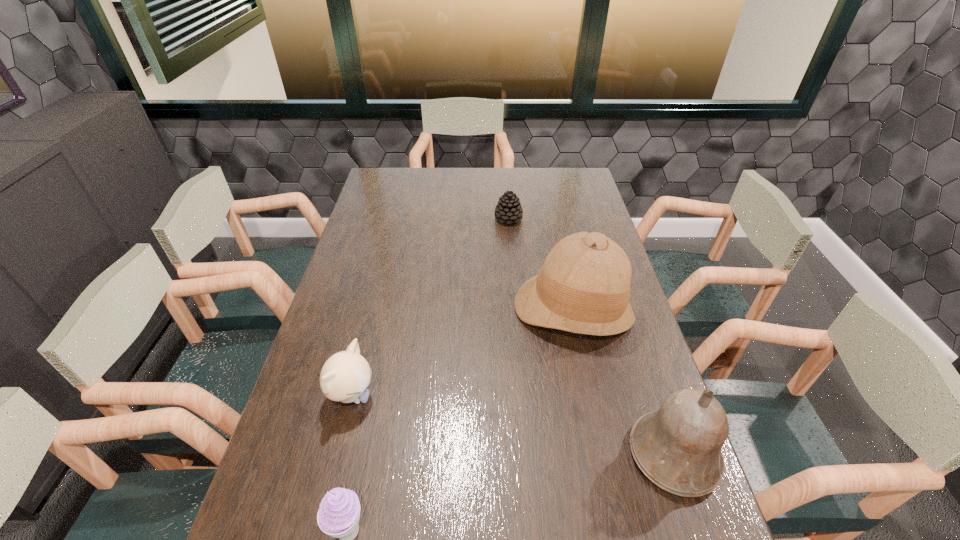
Where is `free spot between the bell and the tallest object`? The image size is (960, 540). free spot between the bell and the tallest object is located at coordinates (623, 382).

Locate an element on the screen. The height and width of the screenshot is (540, 960). free space between the hat and the kitten is located at coordinates (463, 353).

The image size is (960, 540). I want to click on vacant region between the kitten and the fourth shortest object, so click(513, 424).

Locate an element on the screen. The width and height of the screenshot is (960, 540). object that is the third nearest to the nearest object is located at coordinates (678, 448).

Locate which object ranks in proximity to the bell. Please provide its 2D coordinates. Your answer should be formatted as a tuple, i.e. [(x, y)], where the tuple contains the x and y coordinates of a point satisfying the conditions above.

[(583, 287)]

Identify the location of free space that satisfies the following two spatial constraints: 1. on the back side of the farthest object; 2. on the right side of the kitten. (396, 219).

This screenshot has width=960, height=540. What are the coordinates of `vacant space that satisfies the following two spatial constraints: 1. on the front side of the kitten; 2. on the right side of the second tallest object` in the screenshot? It's located at (338, 455).